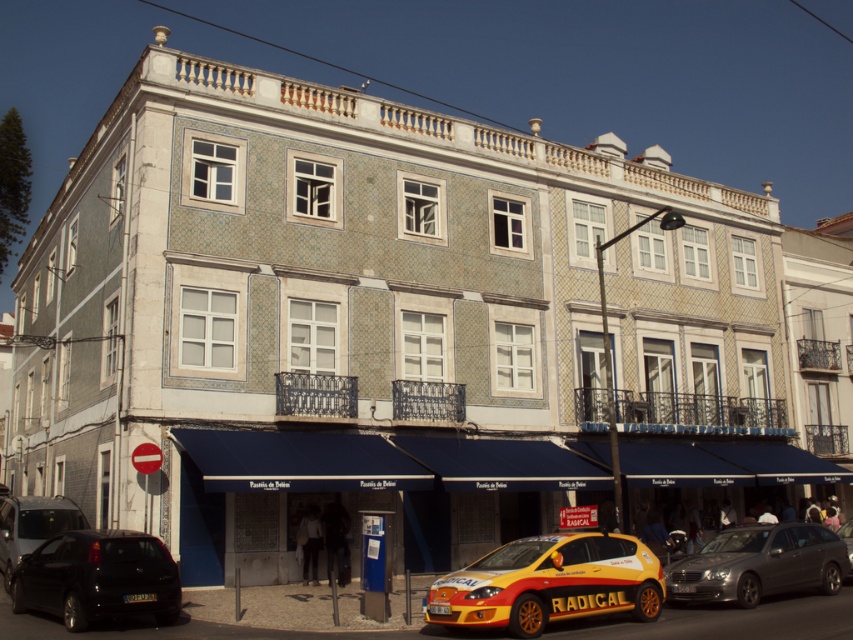
Question: Is metallic gray sedan at lower right in front of yellow plastic license plate at center?

Choices:
 (A) yes
 (B) no

Answer: (B)

Question: Can you confirm if black matte car at lower left is positioned to the left of yellow plastic license plate at center?

Choices:
 (A) yes
 (B) no

Answer: (A)

Question: Estimate the real-world distances between objects in this image. Which object is farther from the yellow-orange metallic taxi at center?

Choices:
 (A) yellow plastic license plate at center
 (B) black matte car at lower left
 (C) matte black van at lower left
 (D) black plastic license plate at lower left

Answer: (C)

Question: Can you confirm if metallic gray sedan at lower right is positioned to the right of yellow plastic license plate at center?

Choices:
 (A) no
 (B) yes

Answer: (B)

Question: Among these points, which one is farthest from the camera?

Choices:
 (A) (16, 532)
 (B) (125, 596)
 (C) (517, 602)

Answer: (A)

Question: Which of the following is the closest to the observer?

Choices:
 (A) black plastic license plate at lower left
 (B) matte black van at lower left
 (C) yellow-orange metallic car at center
 (D) yellow-orange metallic taxi at center

Answer: (D)